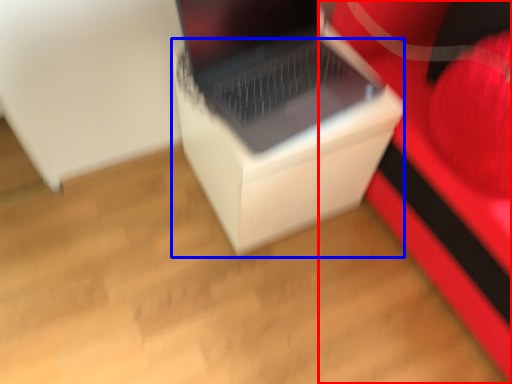
Question: Among these objects, which one is farthest to the camera, furniture (highlighted by a red box) or cardboard box (highlighted by a blue box)?

Choices:
 (A) furniture
 (B) cardboard box

Answer: (B)